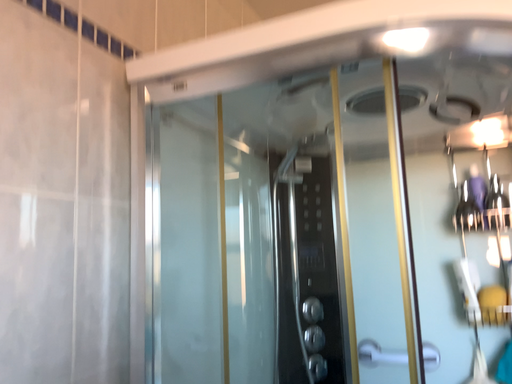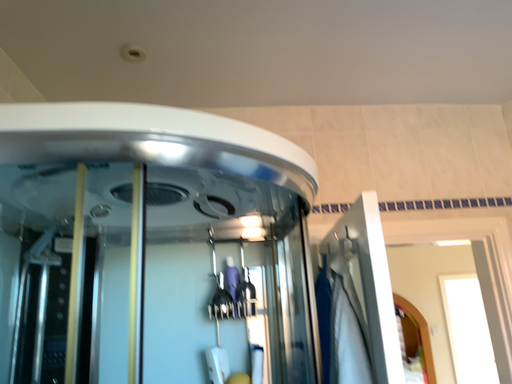
Question: Which way did the camera rotate in the video?

Choices:
 (A) rotated downward
 (B) rotated upward

Answer: (B)